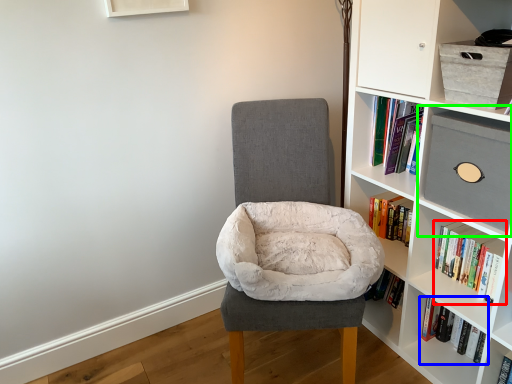
Question: Estimate the real-world distances between objects in this image. Which object is closer to book (highlighted by a red box), book (highlighted by a blue box) or shelf (highlighted by a green box)?

Choices:
 (A) book
 (B) shelf

Answer: (A)